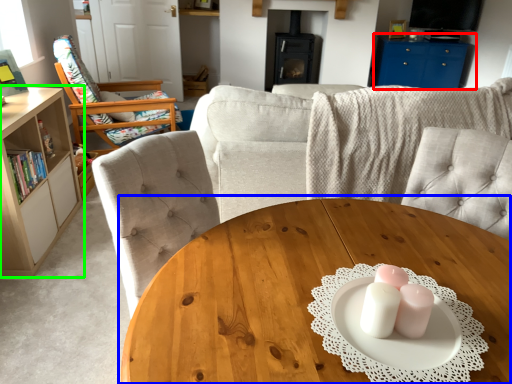
Question: Based on their relative distances, which object is nearer to entertainment center (highlighted by a red box)? Choose from coffee table (highlighted by a blue box) and cabinetry (highlighted by a green box).

Choices:
 (A) coffee table
 (B) cabinetry

Answer: (B)